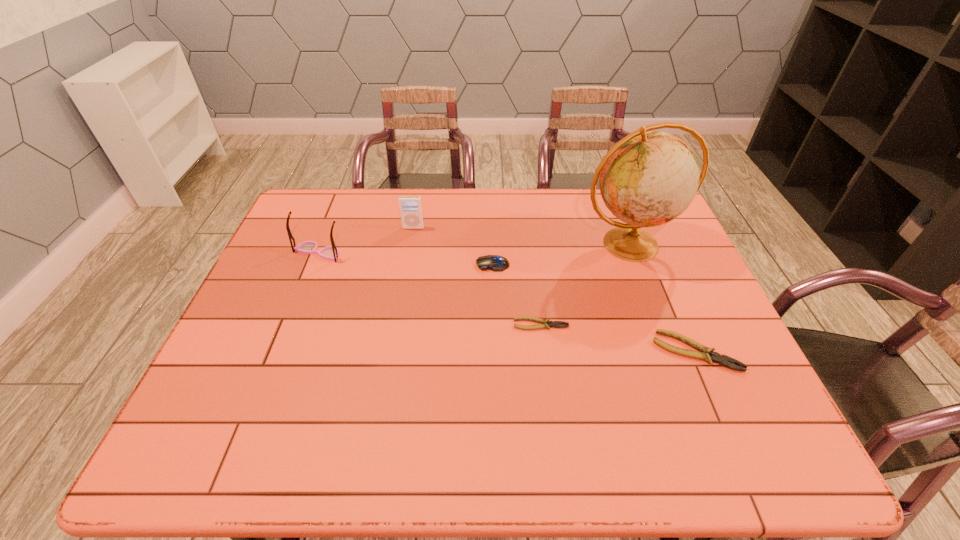
You are a GUI agent. You are given a task and a screenshot of the screen. Output one action in this format:
    pyautogui.click(x=<x>, y=<y>)
    Task: Click on the globe located at the right edge
    
    Given the screenshot: What is the action you would take?
    pyautogui.click(x=648, y=178)

Identify the location of object present at the far right corner. (648, 178).

Identify the location of vacant space at the far edge of the desktop. This screenshot has width=960, height=540. (563, 189).

In the image, there is a desktop. Where is `free space at the near edge`? free space at the near edge is located at coordinates (301, 382).

Locate an element on the screen. Image resolution: width=960 pixels, height=540 pixels. free space at the left edge of the desktop is located at coordinates (286, 242).

Locate an element on the screen. free space between the taller pliers and the globe is located at coordinates (663, 298).

Locate an element on the screen. free space between the computer mouse and the shortest object is located at coordinates (516, 294).

Find the location of a particular element. This screenshot has height=540, width=960. free space between the left pliers and the spectacles is located at coordinates (430, 288).

You are a GUI agent. You are given a task and a screenshot of the screen. Output one action in this format:
    pyautogui.click(x=<x>, y=<y>)
    Task: Click on the free spot between the spectacles and the shortest object
    
    Given the screenshot: What is the action you would take?
    pyautogui.click(x=430, y=288)

What are the coordinates of `vacant space that is in between the nearer pliers and the computer mouse` in the screenshot? It's located at (594, 308).